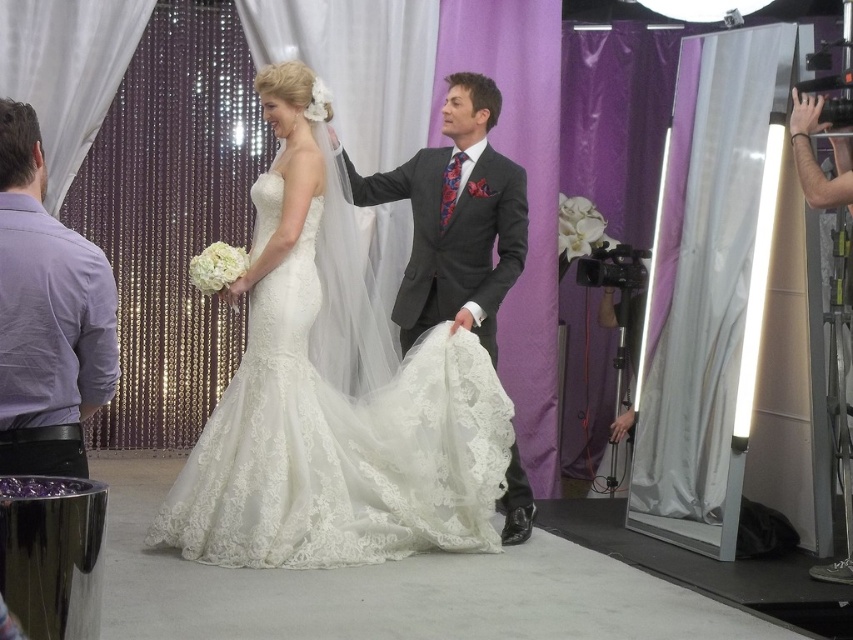
Question: Can you confirm if lace fabric dress at center is positioned above purple cotton shirt at left?

Choices:
 (A) yes
 (B) no

Answer: (B)

Question: Does lace fabric dress at center have a smaller size compared to purple cotton shirt at left?

Choices:
 (A) yes
 (B) no

Answer: (B)

Question: Which point is closer to the camera?

Choices:
 (A) (71, 454)
 (B) (258, 550)
 (C) (531, 525)

Answer: (A)

Question: Among these objects, which one is nearest to the camera?

Choices:
 (A) matte gray suit at center
 (B) purple cotton shirt at left
 (C) lace fabric dress at center

Answer: (B)

Question: Among these points, which one is farthest from the camera?

Choices:
 (A) (113, 340)
 (B) (450, 492)
 (C) (401, 328)

Answer: (C)

Question: Observing the image, what is the correct spatial positioning of lace fabric dress at center in reference to purple cotton shirt at left?

Choices:
 (A) below
 (B) above

Answer: (A)